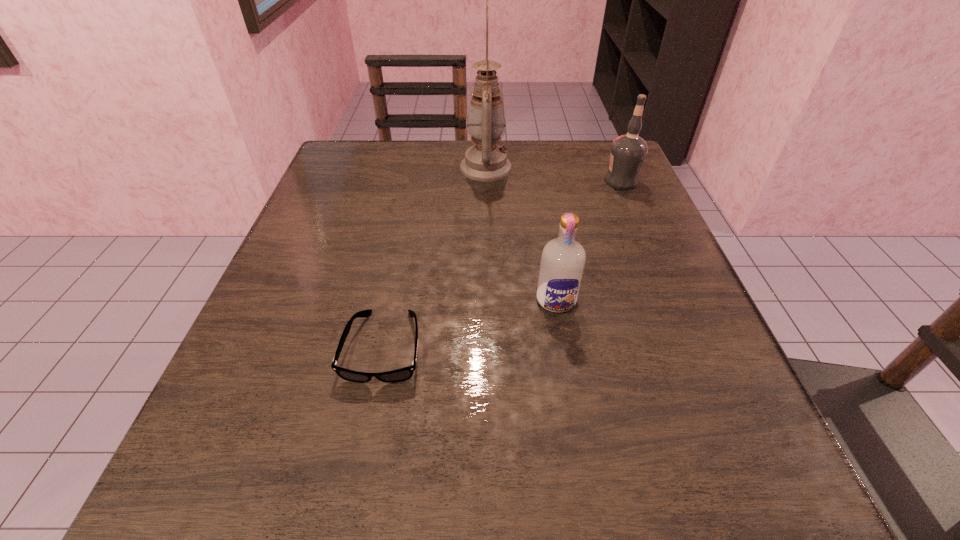
Locate an element on the screen. The image size is (960, 540). vacant space at the near edge is located at coordinates (432, 472).

What are the coordinates of `blank space at the left edge of the desktop` in the screenshot? It's located at (360, 275).

Locate an element on the screen. The height and width of the screenshot is (540, 960). free location at the right edge of the desktop is located at coordinates (653, 263).

Where is `vacant region at the near left corner of the desktop`? This screenshot has width=960, height=540. vacant region at the near left corner of the desktop is located at coordinates (161, 507).

Image resolution: width=960 pixels, height=540 pixels. I want to click on vacant space at the far right corner, so click(x=584, y=143).

Identify the location of free spot at the near right corner of the desktop. The width and height of the screenshot is (960, 540). (796, 496).

Find the location of a particular element. This screenshot has height=540, width=960. vacant area between the shortest object and the third tallest object is located at coordinates (470, 323).

Where is `free space between the shortest object and the rightmost object`? The width and height of the screenshot is (960, 540). free space between the shortest object and the rightmost object is located at coordinates (503, 264).

At what (x,y) coordinates should I click in order to perform the action: click on vacant area that lies between the leftmost object and the left vodka. Please return your answer as a coordinate pair (x, y). This screenshot has height=540, width=960. Looking at the image, I should click on (470, 323).

In order to click on vacant point located between the right vodka and the second object from left to right in this screenshot , I will do pos(554,174).